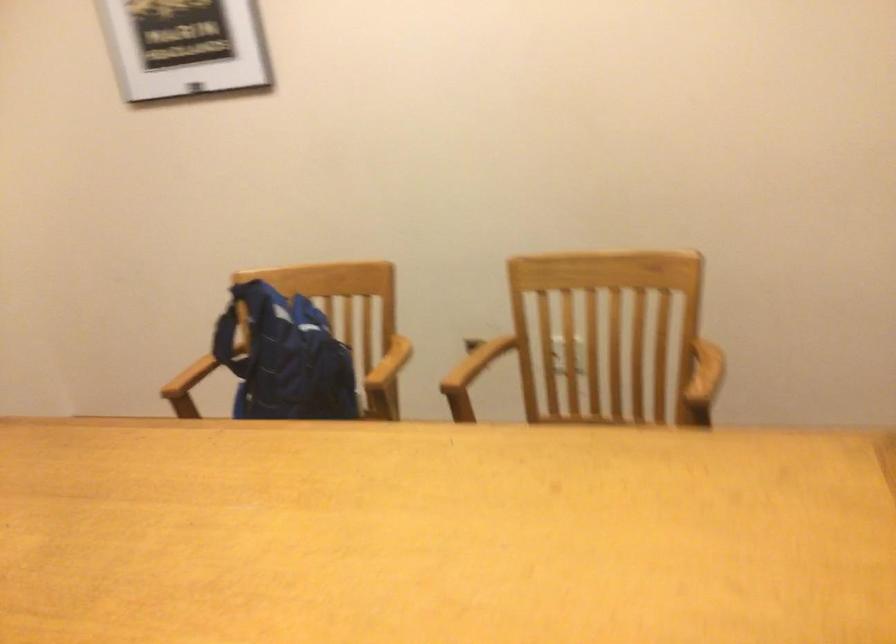
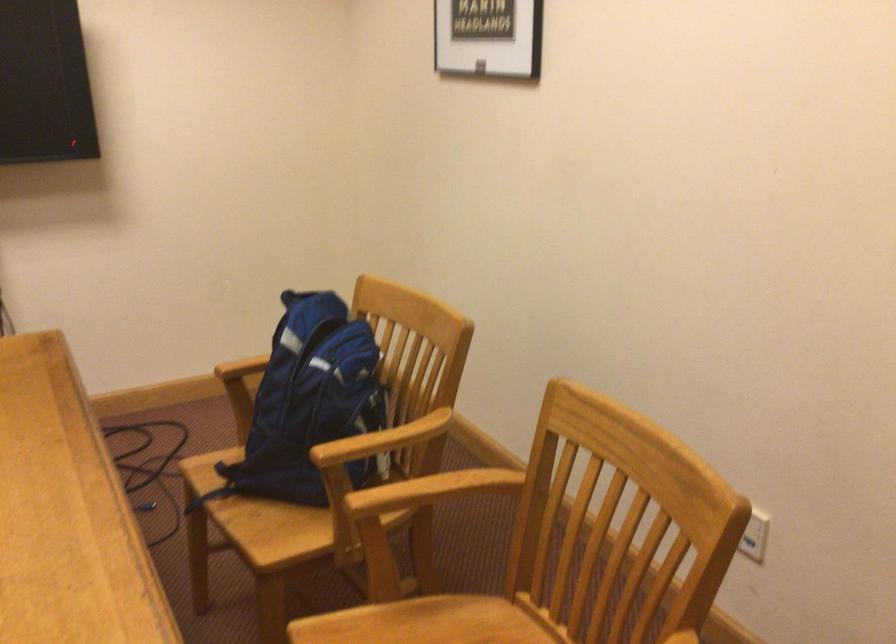
The point at (389, 359) is marked in the first image. Where is the corresponding point in the second image?

(383, 440)